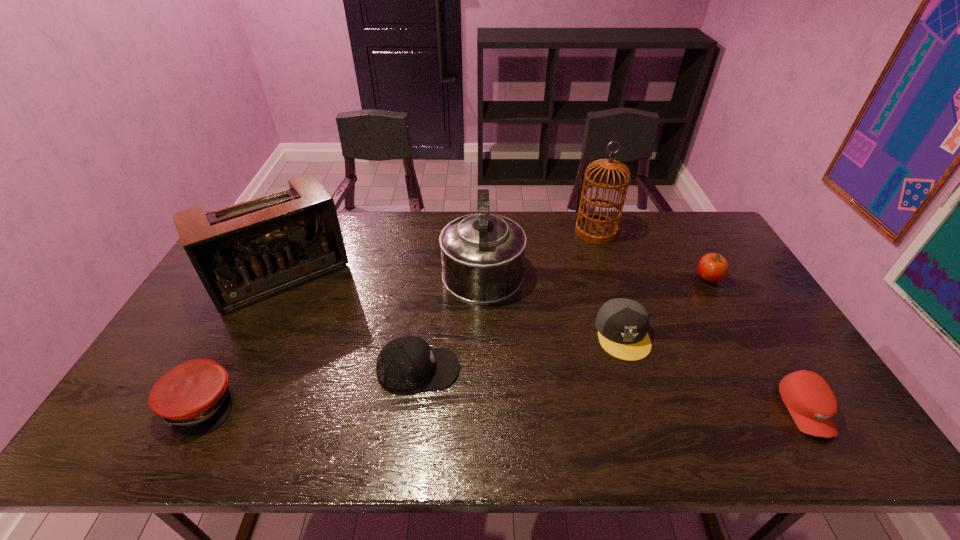
Locate an element on the screen. This screenshot has height=540, width=960. birdcage is located at coordinates (594, 228).

Locate an element on the screen. Image resolution: width=960 pixels, height=540 pixels. kettle is located at coordinates (482, 255).

At what (x,y) coordinates should I click in order to perform the action: click on radio receiver. Please return your answer as a coordinate pair (x, y). Looking at the image, I should click on (247, 252).

At what (x,y) coordinates should I click in order to perform the action: click on apple. Please return your answer as a coordinate pair (x, y). Image resolution: width=960 pixels, height=540 pixels. Looking at the image, I should click on (712, 267).

Where is `the second cap from left to right`? The height and width of the screenshot is (540, 960). the second cap from left to right is located at coordinates (406, 364).

Locate an element on the screen. the second cap from right to left is located at coordinates (622, 324).

Identify the location of the leftmost cap. (194, 397).

I want to click on the rightmost cap, so click(810, 400).

Where is `vacant space situated 0.150m on the left of the birdcage`? This screenshot has height=540, width=960. vacant space situated 0.150m on the left of the birdcage is located at coordinates (534, 232).

This screenshot has height=540, width=960. I want to click on vacant space positioned with the spout at the front of the kettle, so coord(482,214).